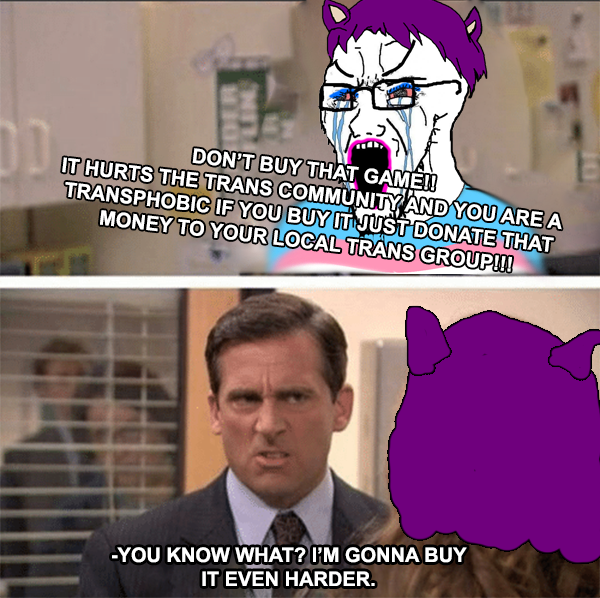
Where is `cabinet`? The width and height of the screenshot is (600, 598). cabinet is located at coordinates (89, 56), (7, 83).